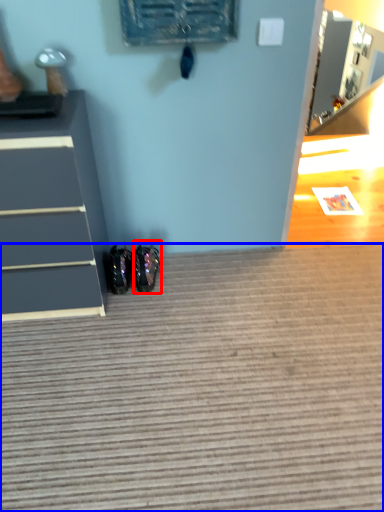
Question: Which of the following is the closest to the observer, footwear (highlighted by a red box) or doormat (highlighted by a blue box)?

Choices:
 (A) footwear
 (B) doormat

Answer: (B)